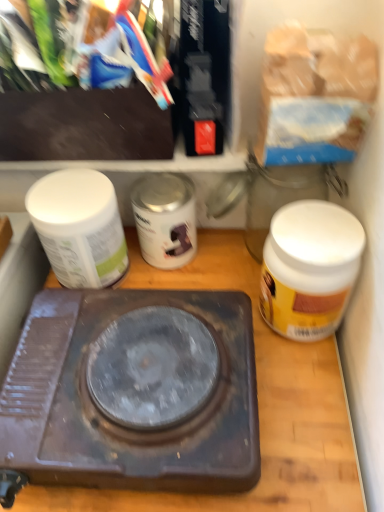
What do you see at coordinates (258, 403) in the screenshot? The width and height of the screenshot is (384, 512). I see `brown matte/wooden counter top at center` at bounding box center [258, 403].

Image resolution: width=384 pixels, height=512 pixels. In order to click on brown matte/wooden counter top at center in this screenshot , I will do `click(258, 403)`.

In order to face white matte jar at right, which is counted as the 1th bottle, starting from the right, should I rotate leftwards or rightwards?

Turn right by 13.777 degrees to look at white matte jar at right, which is counted as the 1th bottle, starting from the right.

This screenshot has height=512, width=384. I want to click on brown matte/wooden counter top at center, so click(258, 403).

Is white matte jar at right, which is counted as the 1th bottle, starting from the right, bigger than silver metallic can at center, the 2th bottle from the right?

Indeed, white matte jar at right, which is counted as the 1th bottle, starting from the right, has a larger size compared to silver metallic can at center, the 2th bottle from the right.

Could you tell me if white matte jar at right, which is counted as the 1th bottle, starting from the right, is turned towards silver metallic can at center, the second bottle when ordered from left to right?

No, white matte jar at right, which is counted as the 1th bottle, starting from the right, is not aimed at silver metallic can at center, the second bottle when ordered from left to right.

Which object is wider, white matte jar at right, which is counted as the 1th bottle, starting from the right, or silver metallic can at center, the second bottle when ordered from left to right?

With larger width is white matte jar at right, which is counted as the 1th bottle, starting from the right.

Is point (297, 286) more distant than point (141, 183)?

No, (297, 286) is closer to viewer.

From a real-world perspective, is silver metallic can at center, the 2th bottle from the right, located higher than brown matte/wooden counter top at center?

Yes, from a real-world perspective, silver metallic can at center, the 2th bottle from the right, is over brown matte/wooden counter top at center

Do you think silver metallic can at center, the second bottle when ordered from left to right, is within brown matte/wooden counter top at center, or outside of it?

silver metallic can at center, the second bottle when ordered from left to right, is spatially situated outside brown matte/wooden counter top at center.

Could you measure the distance between silver metallic can at center, the 2th bottle from the right, and brown matte/wooden counter top at center?

silver metallic can at center, the 2th bottle from the right, is 7.20 inches from brown matte/wooden counter top at center.

Considering the relative sizes of silver metallic can at center, the second bottle when ordered from left to right, and brown matte/wooden counter top at center in the image provided, is silver metallic can at center, the second bottle when ordered from left to right, smaller than brown matte/wooden counter top at center?

Correct, silver metallic can at center, the second bottle when ordered from left to right, occupies less space than brown matte/wooden counter top at center.

Does rusty metal stove at center turn towards silver metallic can at center, the 2th bottle from the right?

No, rusty metal stove at center is not facing towards silver metallic can at center, the 2th bottle from the right.

In the scene shown: Based on their positions, is rusty metal stove at center located to the left or right of silver metallic can at center, the 2th bottle from the right?

Clearly, rusty metal stove at center is on the left of silver metallic can at center, the 2th bottle from the right, in the image.

Which object is further away from the camera taking this photo, rusty metal stove at center or silver metallic can at center, the second bottle when ordered from left to right?

silver metallic can at center, the second bottle when ordered from left to right, is more distant.

Which object is wider, rusty metal stove at center or silver metallic can at center, the second bottle when ordered from left to right?

rusty metal stove at center is wider.

Is point (116, 210) farther from camera compared to point (189, 192)?

No, (116, 210) is in front of (189, 192).

Is white matte jar at left, which appears as the third bottle when viewed from the right, inside the boundaries of silver metallic can at center, the second bottle when ordered from left to right, or outside?

white matte jar at left, which appears as the third bottle when viewed from the right, is not inside silver metallic can at center, the second bottle when ordered from left to right, it's outside.

Are white matte jar at left, the first bottle when ordered from left to right, and silver metallic can at center, the 2th bottle from the right, located far from each other?

No, white matte jar at left, the first bottle when ordered from left to right, is not far from silver metallic can at center, the 2th bottle from the right.

Which object is wider, silver metallic can at center, the second bottle when ordered from left to right, or white matte jar at right, which is counted as the 1th bottle, starting from the right?

Wider between the two is white matte jar at right, which is counted as the 1th bottle, starting from the right.

Considering their positions, is silver metallic can at center, the second bottle when ordered from left to right, located in front of or behind white matte jar at right, which is counted as the 1th bottle, starting from the right?

In the image, silver metallic can at center, the second bottle when ordered from left to right, appears behind white matte jar at right, which is counted as the 1th bottle, starting from the right.

Is silver metallic can at center, the 2th bottle from the right, in contact with white matte jar at right, which is counted as the 1th bottle, starting from the right?

No, silver metallic can at center, the 2th bottle from the right, is not beside white matte jar at right, which is counted as the 1th bottle, starting from the right.

Based on the photo, from the image's perspective, which is above, silver metallic can at center, the 2th bottle from the right, or white matte jar at right, which is counted as the 1th bottle, starting from the right?

silver metallic can at center, the 2th bottle from the right, is shown above in the image.

From the image's perspective, between white matte jar at left, the first bottle when ordered from left to right, and rusty metal stove at center, who is located below?

From the image's view, rusty metal stove at center is below.

Considering the relative positions of white matte jar at left, the first bottle when ordered from left to right, and rusty metal stove at center in the image provided, is white matte jar at left, the first bottle when ordered from left to right, to the left of rusty metal stove at center from the viewer's perspective?

Yes.

Choose the correct answer: Is white matte jar at left, the first bottle when ordered from left to right, inside rusty metal stove at center or outside it?

white matte jar at left, the first bottle when ordered from left to right, is located beyond the bounds of rusty metal stove at center.

From the image's perspective, would you say white matte jar at left, which appears as the third bottle when viewed from the right, is positioned over brown matte/wooden counter top at center?

Yes, from the image's perspective, white matte jar at left, which appears as the third bottle when viewed from the right, is above brown matte/wooden counter top at center.

Is white matte jar at left, the first bottle when ordered from left to right, completely or partially outside of brown matte/wooden counter top at center?

Indeed, white matte jar at left, the first bottle when ordered from left to right, is completely outside brown matte/wooden counter top at center.

From the picture: Could you tell me if white matte jar at left, which appears as the third bottle when viewed from the right, is turned towards brown matte/wooden counter top at center?

No, white matte jar at left, which appears as the third bottle when viewed from the right, is not turned towards brown matte/wooden counter top at center.

Would you say white matte jar at left, the first bottle when ordered from left to right, is to the left or to the right of brown matte/wooden counter top at center in the picture?

white matte jar at left, the first bottle when ordered from left to right, is positioned on brown matte/wooden counter top at center's left side.

Locate an element on the screen. This screenshot has width=384, height=512. bottle that is the 2nd one when counting forward from the silver metallic can at center, the 2th bottle from the right is located at coordinates (309, 268).

This screenshot has width=384, height=512. Identify the location of the 3rd bottle behind the brown matte/wooden counter top at center. (165, 219).

When comparing their distances from rusty metal stove at center, does brown matte/wooden counter top at center or silver metallic can at center, the second bottle when ordered from left to right, seem closer?

brown matte/wooden counter top at center.

Looking at the image, which one is located closer to silver metallic can at center, the 2th bottle from the right, brown matte/wooden counter top at center or white matte jar at right, the third bottle when ordered from left to right?

brown matte/wooden counter top at center.

Considering their positions, is rusty metal stove at center positioned closer to white matte jar at left, which appears as the third bottle when viewed from the right, than brown matte/wooden counter top at center?

rusty metal stove at center.

Estimate the real-world distances between objects in this image. Which object is closer to rusty metal stove at center, brown matte/wooden counter top at center or white matte jar at left, the first bottle when ordered from left to right?

The object closer to rusty metal stove at center is brown matte/wooden counter top at center.

Based on their spatial positions, is silver metallic can at center, the second bottle when ordered from left to right, or white matte jar at right, which is counted as the 1th bottle, starting from the right, closer to white matte jar at left, the first bottle when ordered from left to right?

silver metallic can at center, the second bottle when ordered from left to right, lies closer to white matte jar at left, the first bottle when ordered from left to right, than the other object.

Estimate the real-world distances between objects in this image. Which object is further from brown matte/wooden counter top at center, rusty metal stove at center or white matte jar at right, which is counted as the 1th bottle, starting from the right?

Based on the image, white matte jar at right, which is counted as the 1th bottle, starting from the right, appears to be further to brown matte/wooden counter top at center.

Based on the photo, estimate the real-world distances between objects in this image. Which object is closer to brown matte/wooden counter top at center, white matte jar at left, which appears as the third bottle when viewed from the right, or white matte jar at right, which is counted as the 1th bottle, starting from the right?

white matte jar at right, which is counted as the 1th bottle, starting from the right.

Looking at the image, which one is located further to silver metallic can at center, the second bottle when ordered from left to right, white matte jar at left, which appears as the third bottle when viewed from the right, or rusty metal stove at center?

Among the two, rusty metal stove at center is located further to silver metallic can at center, the second bottle when ordered from left to right.

The height and width of the screenshot is (512, 384). In order to click on counter top situated between white matte jar at left, which appears as the third bottle when viewed from the right, and white matte jar at right, which is counted as the 1th bottle, starting from the right, from left to right in this screenshot , I will do `click(258, 403)`.

Find the location of a particular element. counter top between silver metallic can at center, the 2th bottle from the right, and white matte jar at right, the third bottle when ordered from left to right, from left to right is located at coordinates (258, 403).

The height and width of the screenshot is (512, 384). In order to click on bottle between white matte jar at left, the first bottle when ordered from left to right, and white matte jar at right, the third bottle when ordered from left to right, in the horizontal direction in this screenshot , I will do `click(165, 219)`.

Where is `stove located between white matte jar at left, which appears as the third bottle when viewed from the right, and white matte jar at right, the third bottle when ordered from left to right, in the left-right direction`? Image resolution: width=384 pixels, height=512 pixels. stove located between white matte jar at left, which appears as the third bottle when viewed from the right, and white matte jar at right, the third bottle when ordered from left to right, in the left-right direction is located at coordinates (134, 391).